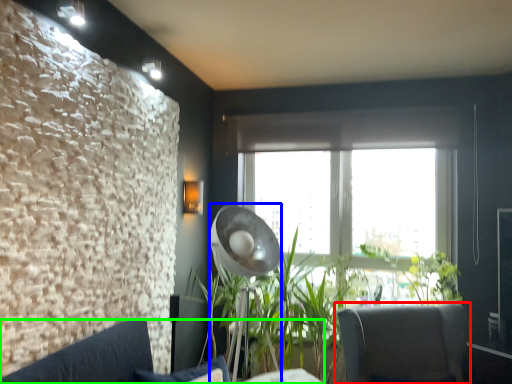
Question: Which is nearer to the chair (highlighted by a red box)? lamp (highlighted by a blue box) or studio couch (highlighted by a green box).

Choices:
 (A) lamp
 (B) studio couch

Answer: (A)